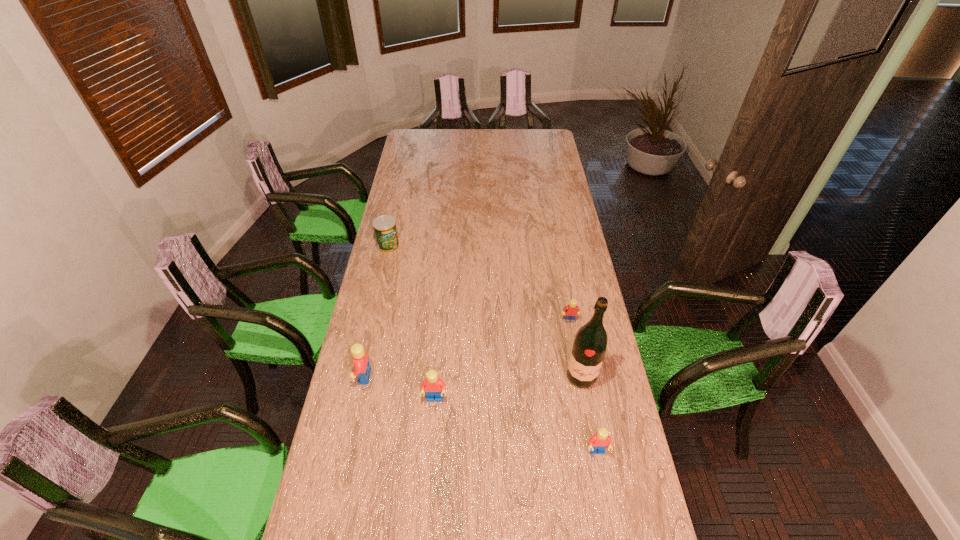
Please determine a free point for an extra Lego to ensure balance. Please provide its 2D coordinates. Your answer should be formatted as a tuple, i.e. [(x, y)], where the tuple contains the x and y coordinates of a point satisfying the conditions above.

[(512, 424)]